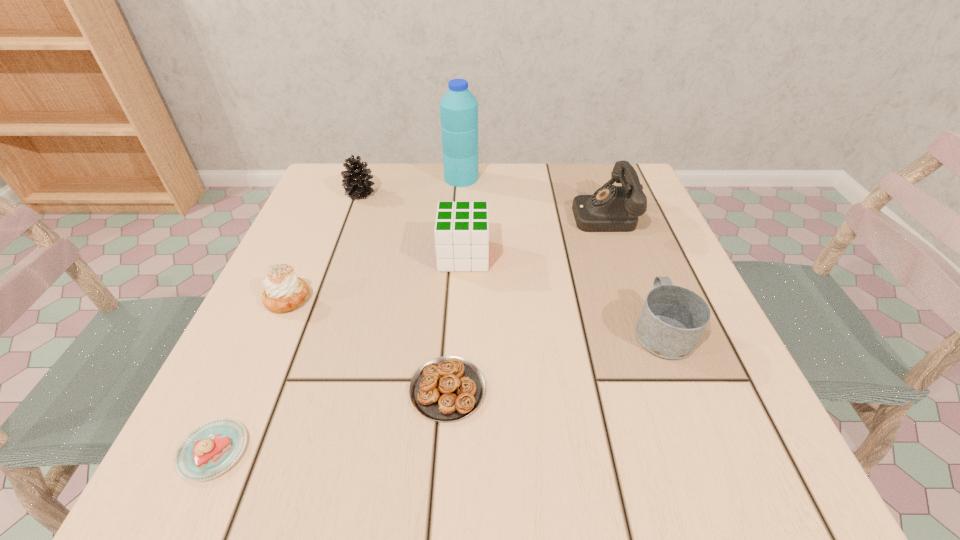
Locate an element on the screen. The width and height of the screenshot is (960, 540). vacant area that satisfies the following two spatial constraints: 1. on the dial of the telephone; 2. on the side of the mug with the handle is located at coordinates tap(642, 329).

At what (x,y) coordinates should I click in order to perform the action: click on vacant space that satisfies the following two spatial constraints: 1. on the back side of the water bottle; 2. on the right side of the rightmost pastry. Please return your answer as a coordinate pair (x, y). Looking at the image, I should click on (461, 178).